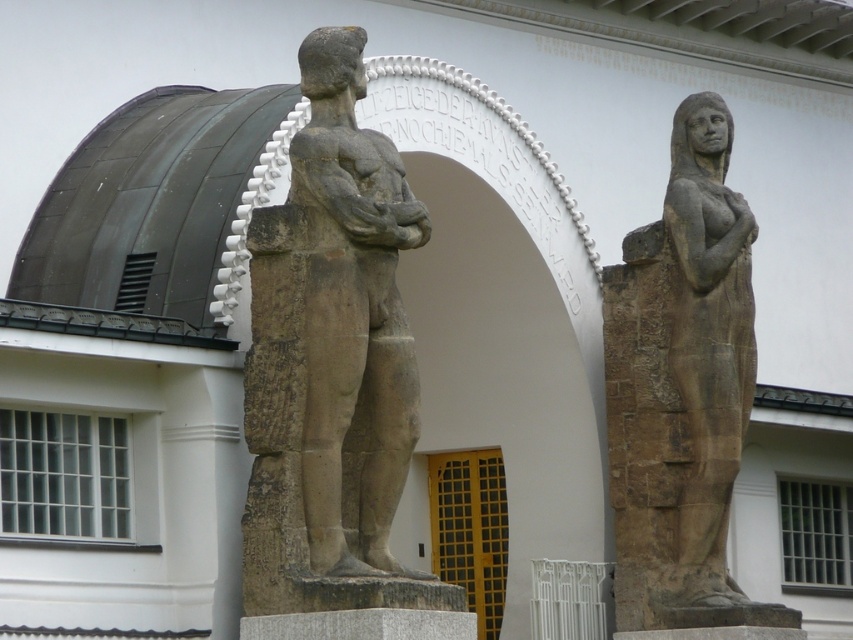
Question: Can you confirm if stone statue at center is positioned to the left of matte stone statue at right?

Choices:
 (A) yes
 (B) no

Answer: (A)

Question: Based on their relative distances, which object is farther from the brown stone statue at right?

Choices:
 (A) matte stone statue at right
 (B) stone statue at center

Answer: (B)

Question: Is stone statue at center smaller than matte stone statue at right?

Choices:
 (A) yes
 (B) no

Answer: (B)

Question: Is stone statue at center bigger than brown stone statue at right?

Choices:
 (A) no
 (B) yes

Answer: (A)

Question: Which of the following is the closest to the observer?

Choices:
 (A) brown stone statue at right
 (B) matte stone statue at right
 (C) stone statue at center

Answer: (C)

Question: Considering the real-world distances, which object is closest to the matte stone statue at right?

Choices:
 (A) stone statue at center
 (B) brown stone statue at right

Answer: (B)